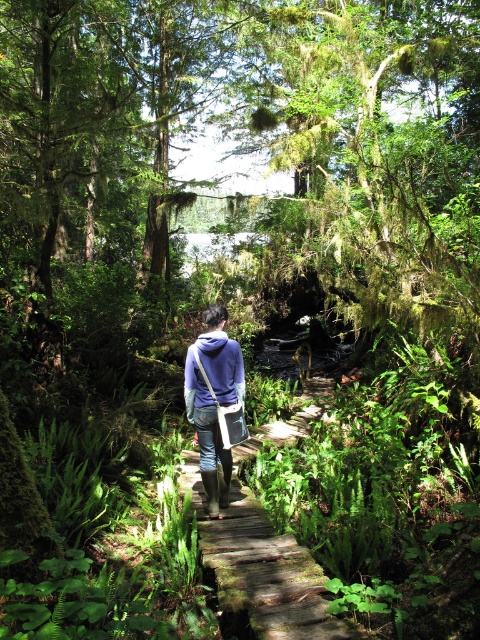
You are a hiker carrying a backpack and need to pass through the narrow wooden boardwalk path. The wooden at center and the purple matte jacket at center are both on the path. Which object takes up more space horizontally on the path?

The purple matte jacket at center takes up more space horizontally on the path since the wooden at center has a lesser width compared to it.

You are a hiker who wants to place a small backpack on the wooden at center. Can you do this without the purple matte jacket at center blocking the space?

The wooden at center is located below purple matte jacket at center, so placing the backpack there would not be blocked by the jacket since the jacket is above the wooden surface.

You are a hiker who wants to take a photo of the purple matte jacket at center and the wooden at center. Which object should you focus on first to ensure both are in the frame?

The purple matte jacket at center is behind the wooden at center, so you should focus on the wooden at center first to ensure both are in the frame.